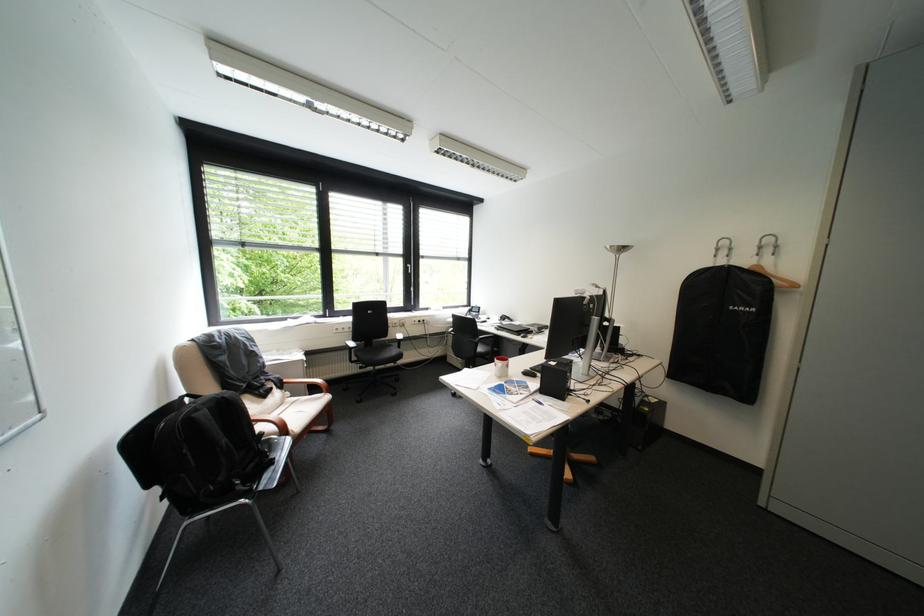
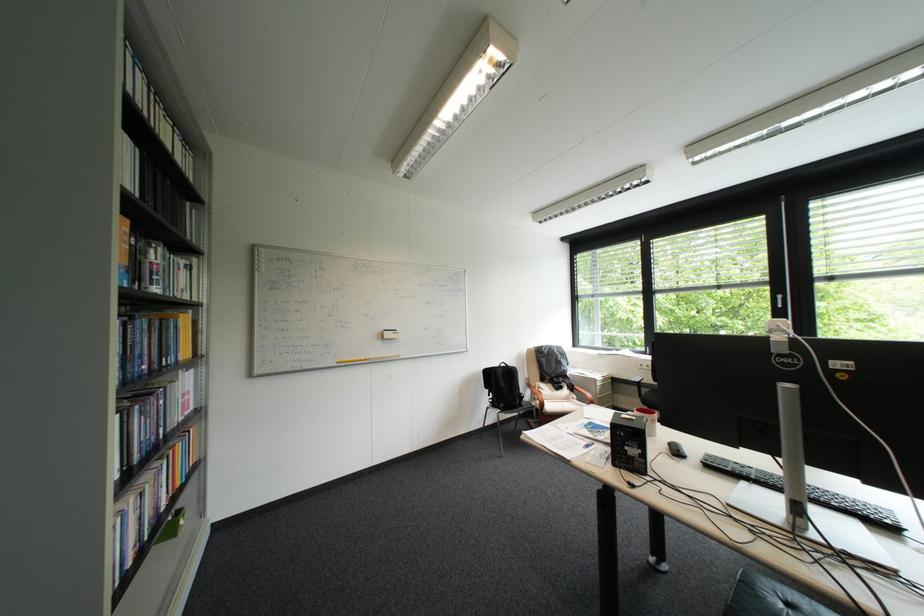
Where in the second image is the point corresponding to point (282, 395) from the first image?

(573, 391)